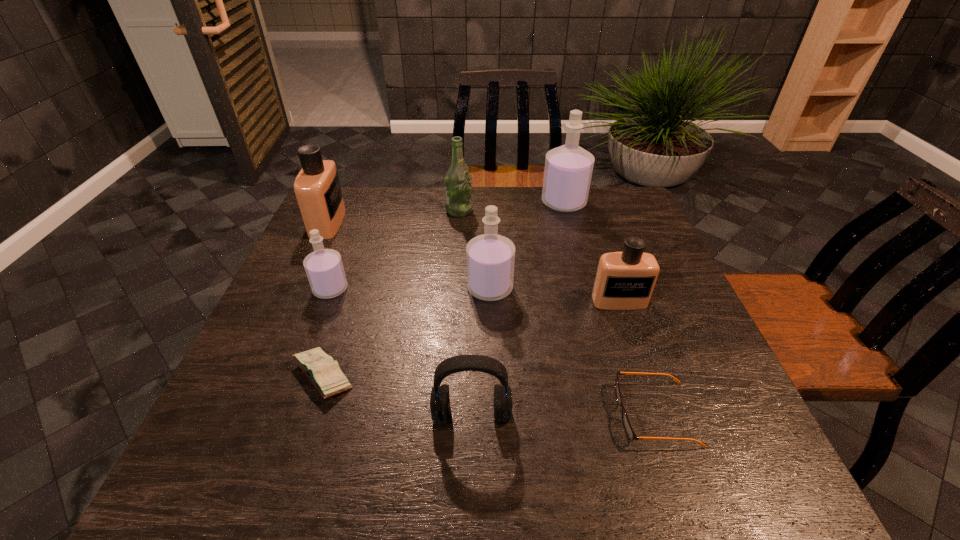
Identify the location of vacant space in between the leftmost purple perfume and the tallest perfume. The height and width of the screenshot is (540, 960). (447, 246).

Where is `vacant area that lies between the diary and the farther beige perfume`? vacant area that lies between the diary and the farther beige perfume is located at coordinates (325, 299).

Locate an element on the screen. This screenshot has height=540, width=960. free point between the second biggest purple perfume and the smaller beige perfume is located at coordinates (555, 295).

The image size is (960, 540). Find the location of `vacant space that is in between the leftmost purple perfume and the biggest purple perfume`. vacant space that is in between the leftmost purple perfume and the biggest purple perfume is located at coordinates (447, 246).

The width and height of the screenshot is (960, 540). In order to click on free space between the green beer bottle and the black spectacles in this screenshot , I will do `click(557, 312)`.

Identify the location of free area in between the pink diary and the headset. (397, 395).

Identify which object is the eighth closest to the leftmost purple perfume. Please provide its 2D coordinates. Your answer should be formatted as a tuple, i.e. [(x, y)], where the tuple contains the x and y coordinates of a point satisfying the conditions above.

[(628, 428)]

Find the location of a particular element. The width and height of the screenshot is (960, 540). the fifth closest object to the biggest purple perfume is located at coordinates (317, 187).

Select which perfume is the second closest to the black spectacles. Please provide its 2D coordinates. Your answer should be formatted as a tuple, i.e. [(x, y)], where the tuple contains the x and y coordinates of a point satisfying the conditions above.

[(490, 257)]

At what (x,y) coordinates should I click in order to perform the action: click on perfume object that ranks as the third closest to the right beige perfume. Please return your answer as a coordinate pair (x, y). The width and height of the screenshot is (960, 540). Looking at the image, I should click on (324, 268).